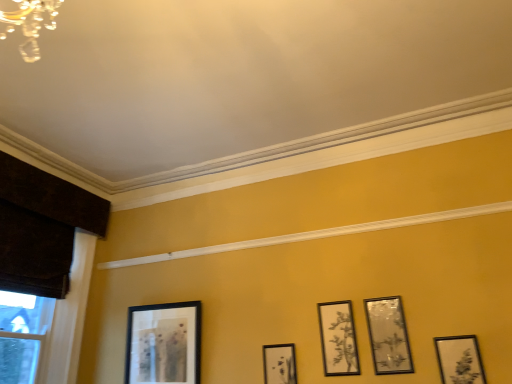
Question: From the image's perspective, relative to matte black picture frame at lower right, acting as the 1th picture frame starting from the right, is matte black picture frame at center, which is counted as the 3th picture frame, starting from the left, above or below?

Choices:
 (A) above
 (B) below

Answer: (A)

Question: From a real-world perspective, is matte black picture frame at center, which is counted as the 3th picture frame, starting from the left, positioned above or below matte black picture frame at lower right, acting as the 1th picture frame starting from the right?

Choices:
 (A) above
 (B) below

Answer: (A)

Question: Considering the real-world distances, which object is farthest from the black matte picture frame at lower left, the first picture frame in the left-to-right sequence?

Choices:
 (A) matte black picture frame at center, acting as the 3th picture frame starting from the right
 (B) matte black picture frame at lower right, which is counted as the fifth picture frame, starting from the left
 (C) matte black picture frame at center, which appears as the second picture frame when viewed from the left
 (D) matte silver picture frame at upper right, the 4th picture frame viewed from the left
 (E) dark brown wood at left

Answer: (B)

Question: Which object is positioned closest to the black matte picture frame at lower left, marked as the 5th picture frame in a right-to-left arrangement?

Choices:
 (A) matte black picture frame at center, which is counted as the 3th picture frame, starting from the left
 (B) matte silver picture frame at upper right, the 4th picture frame viewed from the left
 (C) dark brown wood at left
 (D) matte black picture frame at lower right, acting as the 1th picture frame starting from the right
 (E) matte black picture frame at center, which appears as the second picture frame when viewed from the left

Answer: (C)